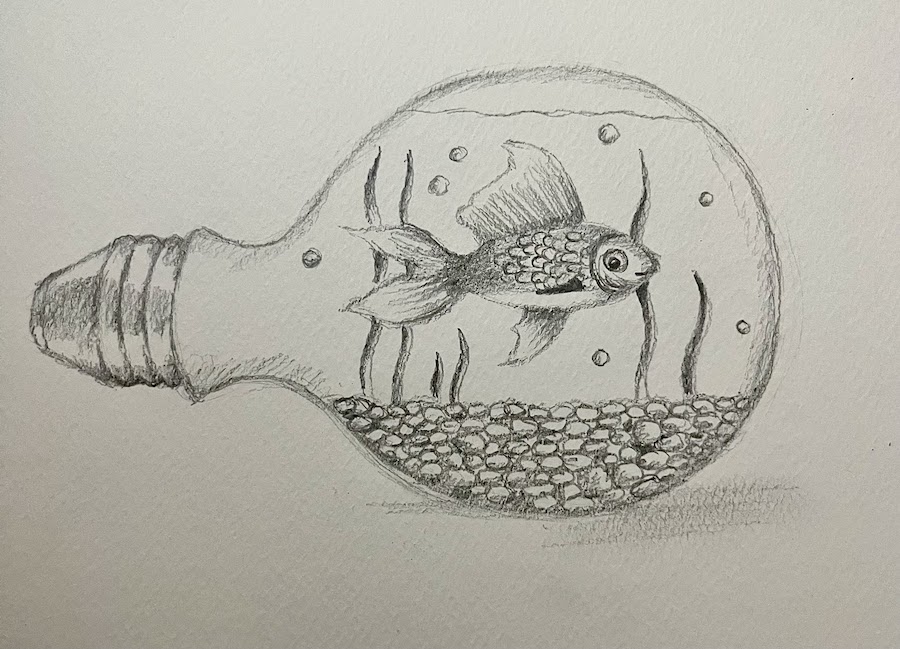
This screenshot has width=900, height=649. Identify the location of bulb main. (681, 197).